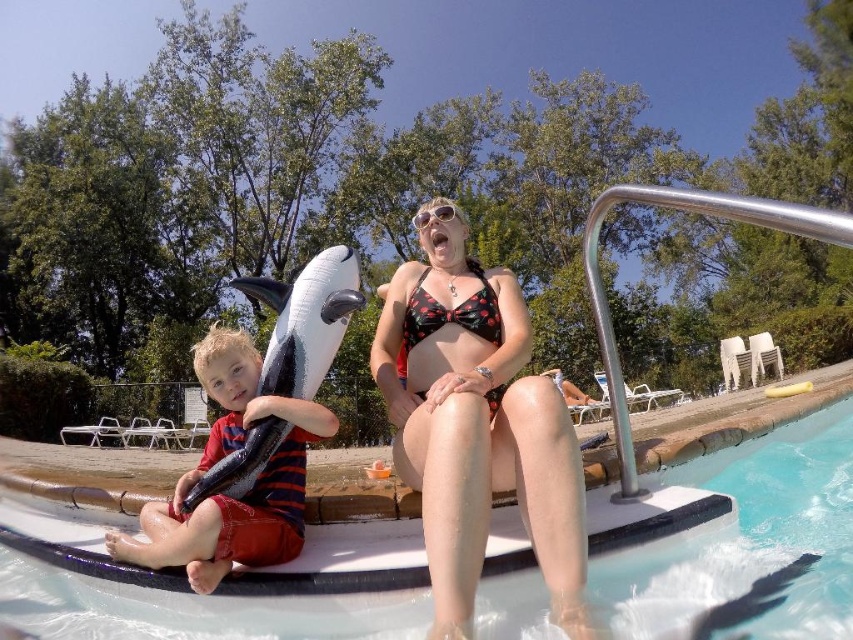
Looking at this image, you are a photographer standing at the poolside. You want to take a photo of the striped cotton shirt at left and the white glossy water at lower center. Which object is positioned lower in the frame?

The white glossy water at lower center is positioned lower in the frame than the striped cotton shirt at left.